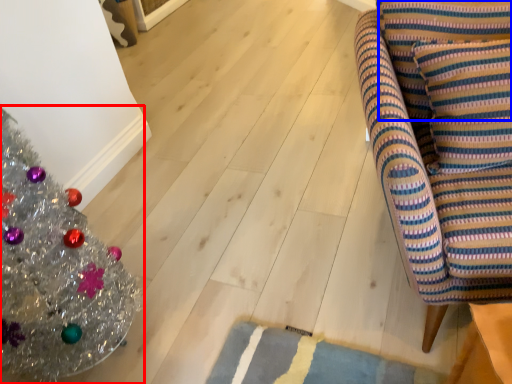
Question: Which object is closer to the camera taking this photo, christmas tree (highlighted by a red box) or pillow (highlighted by a blue box)?

Choices:
 (A) christmas tree
 (B) pillow

Answer: (A)